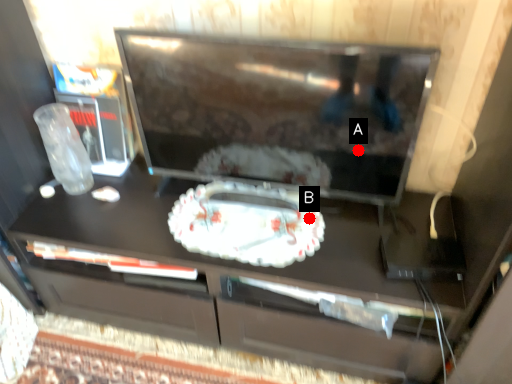
Question: Two points are circled on the image, labeled by A and B beside each circle. Among these points, which one is nearest to the camera?

Choices:
 (A) A is closer
 (B) B is closer

Answer: (A)